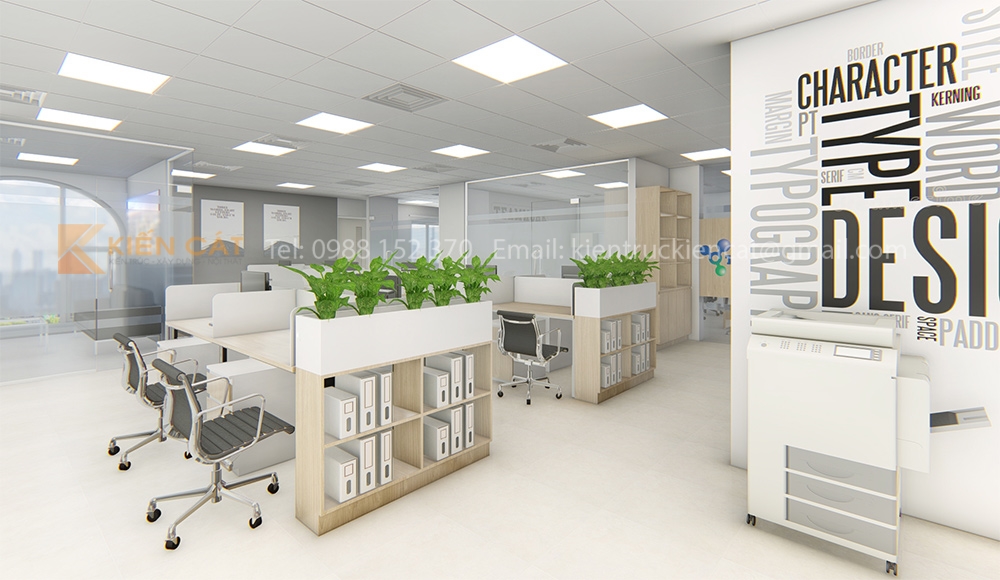
The height and width of the screenshot is (580, 1000). Identify the location of desk. (194, 324), (567, 310), (263, 337).